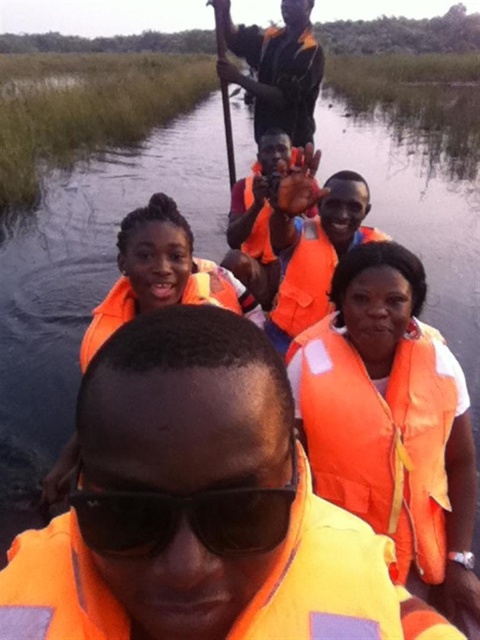
You are part of a tour group on a narrow waterway. You notice two orange life vests. One is labeled as the orange life vest at center and the other as orange life vest at upper center. From your perspective, which life vest is positioned to the left of the other?

The orange life vest at center is positioned to the left of the orange life vest at upper center.